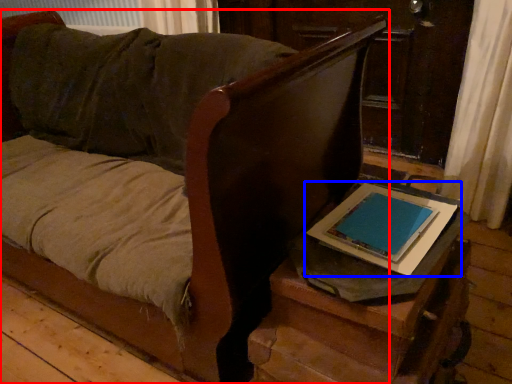
Question: Among these objects, which one is farthest to the camera, furniture (highlighted by a red box) or tablet computer (highlighted by a blue box)?

Choices:
 (A) furniture
 (B) tablet computer

Answer: (B)